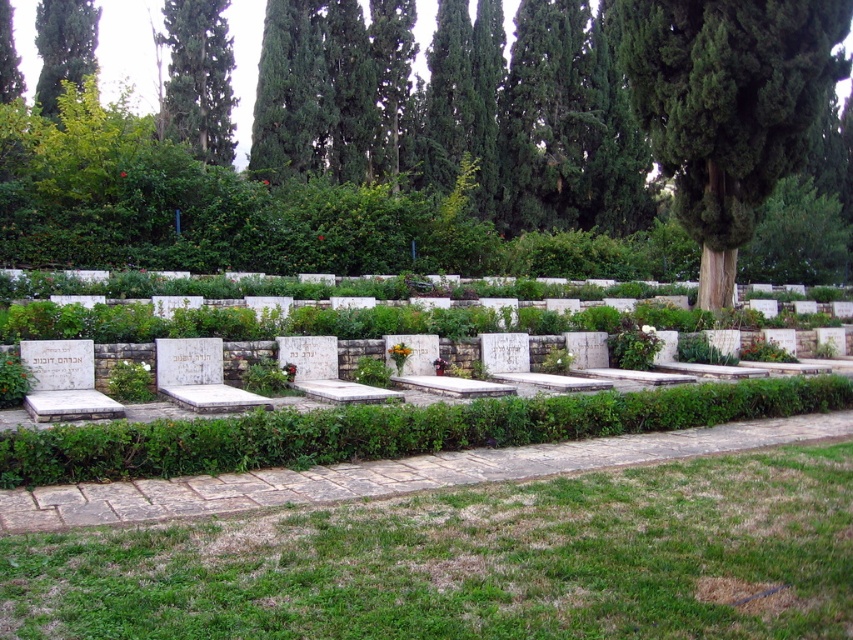
You are a gardener who needs to trim the green leafy tree at center and the green grass at lower center. Based on the scene, which of these two requires more time to maintain?

The green leafy tree at center requires more time to maintain because it is larger in size than the green grass at lower center.

You are a landscape architect designing a walking path through the cemetery. You want to ensure that the path between the green leafy tree at center and the green leafy tree at upper left is wide enough for a wheelchair. The wheelchair requires a minimum width of 1.2 meters. Can you determine if the path between them is wide enough based on the trees? Please explain your reasoning.

The green leafy tree at center has a larger width than the green leafy tree at upper left. However, the description does not provide specific measurements for the path width between them, only the relative sizes of the trees. Therefore, it is impossible to determine if the path meets the wheelchair requirement based solely on the tree widths provided.